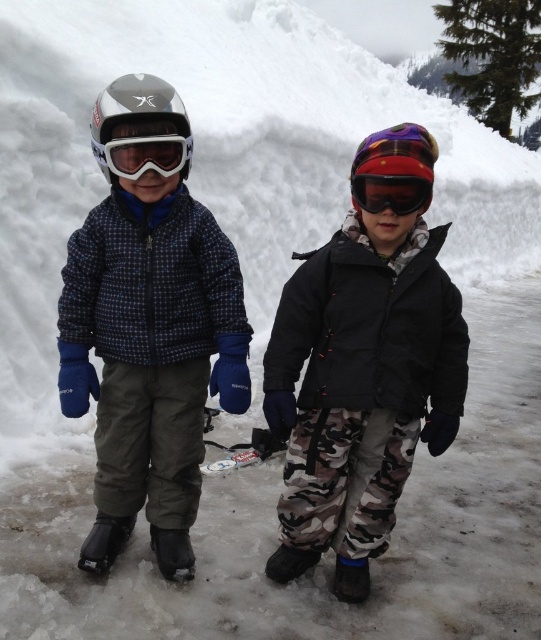
Question: Which object is farther from the camera taking this photo?

Choices:
 (A) red matte ski goggles at center
 (B) matte blue jacket at left
 (C) matte black helmet at left

Answer: (B)

Question: Which point is farther to the camera?

Choices:
 (A) (357, 163)
 (B) (117, 161)

Answer: (B)

Question: Which point is closer to the camera?

Choices:
 (A) (282, 376)
 (B) (385, 202)
 (C) (430, 152)
 (D) (265, 451)

Answer: (B)

Question: Can you confirm if matte black jacket at center is smaller than red matte ski goggles at center?

Choices:
 (A) yes
 (B) no

Answer: (B)

Question: Does camo fabric snow pants at center appear on the left side of red matte ski goggles at center?

Choices:
 (A) yes
 (B) no

Answer: (A)

Question: Does camo fabric snow pants at center appear under white plastic ski at center?

Choices:
 (A) yes
 (B) no

Answer: (B)